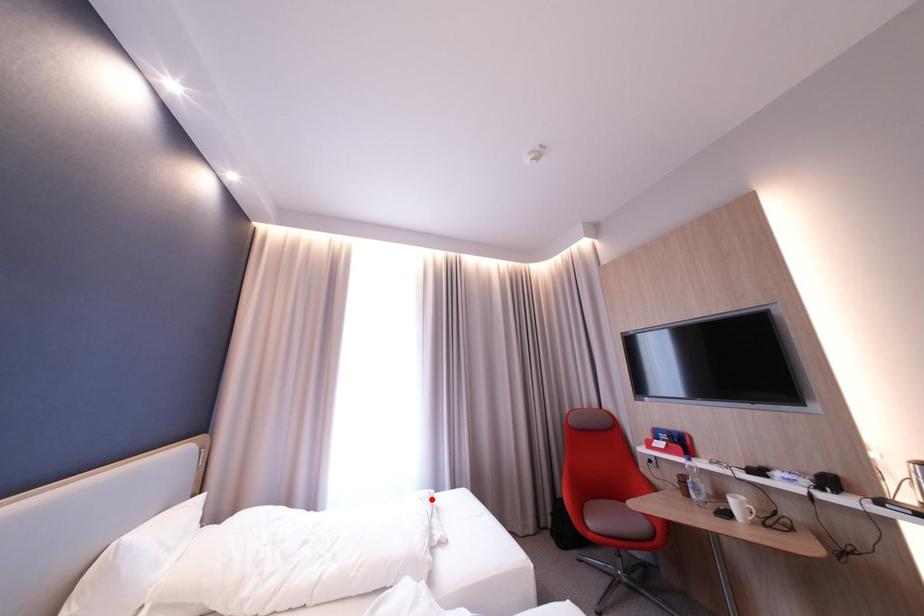
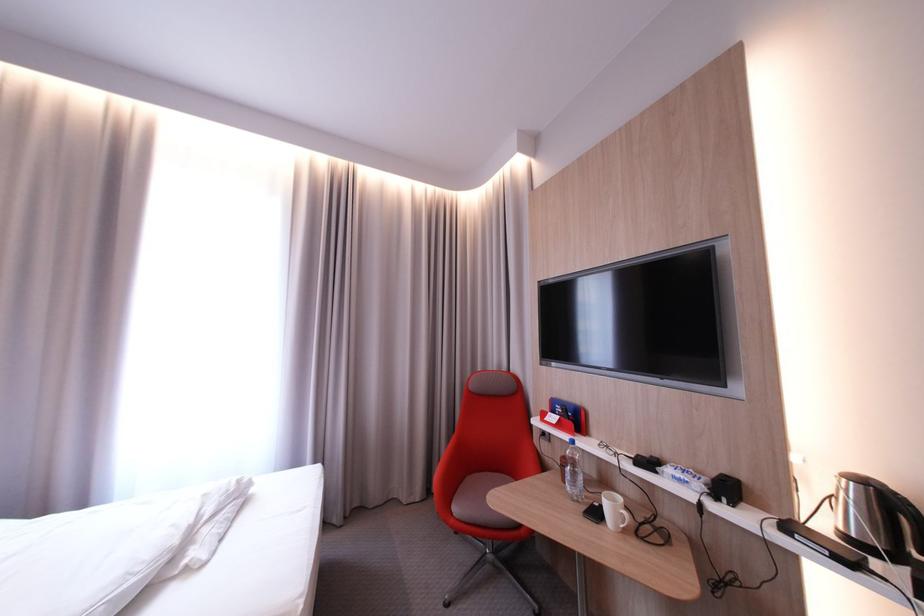
The point at the highlighted location is marked in the first image. Where is the corresponding point in the second image?

(215, 496)